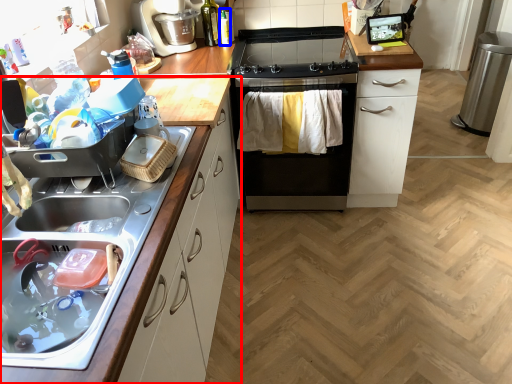
Question: Among these objects, which one is farthest to the camera, cabinetry (highlighted by a red box) or bottle (highlighted by a blue box)?

Choices:
 (A) cabinetry
 (B) bottle

Answer: (B)